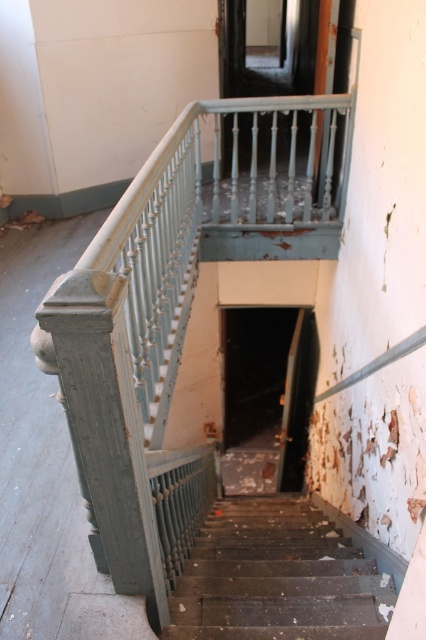
Which is more to the right, matte gray railing at upper center or dark brown wooden stairs at center?

matte gray railing at upper center is more to the right.

Between matte gray railing at upper center and dark brown wooden stairs at center, which one is positioned higher?

matte gray railing at upper center is higher up.

Who is more distant from viewer, [134,413] or [187,561]?

The point [187,561] is behind.

Identify the location of matte gray railing at upper center. The width and height of the screenshot is (426, 640). (178, 310).